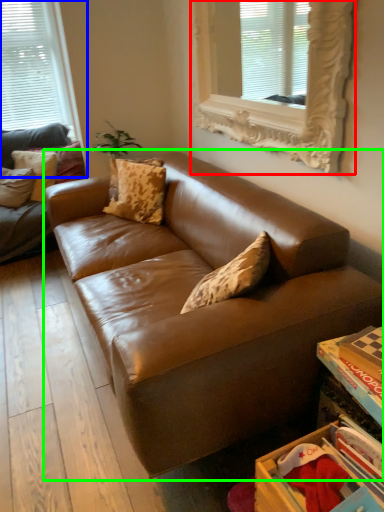
Question: Based on their relative distances, which object is nearer to window (highlighted by a red box)? Choose from window (highlighted by a blue box) and studio couch (highlighted by a green box).

Choices:
 (A) window
 (B) studio couch

Answer: (B)